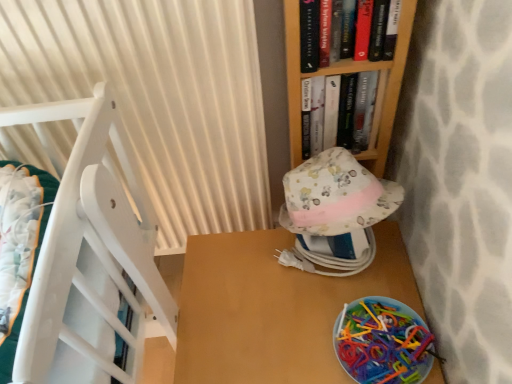
Question: Considering the relative sizes of white pleated curtain at left and floral fabric hat at center in the image provided, is white pleated curtain at left taller than floral fabric hat at center?

Choices:
 (A) yes
 (B) no

Answer: (A)

Question: Could floral fabric hat at center be considered to be inside white pleated curtain at left?

Choices:
 (A) yes
 (B) no

Answer: (B)

Question: Can we say white pleated curtain at left lies outside floral fabric hat at center?

Choices:
 (A) yes
 (B) no

Answer: (A)

Question: Considering the relative sizes of white pleated curtain at left and floral fabric hat at center in the image provided, is white pleated curtain at left smaller than floral fabric hat at center?

Choices:
 (A) yes
 (B) no

Answer: (B)

Question: From a real-world perspective, is white pleated curtain at left located higher than floral fabric hat at center?

Choices:
 (A) yes
 (B) no

Answer: (A)

Question: Considering the relative sizes of white pleated curtain at left and floral fabric hat at center in the image provided, is white pleated curtain at left thinner than floral fabric hat at center?

Choices:
 (A) no
 (B) yes

Answer: (B)

Question: Is there a large distance between wooden table at lower right and floral fabric hat at center?

Choices:
 (A) no
 (B) yes

Answer: (A)

Question: Is wooden table at lower right taller than floral fabric hat at center?

Choices:
 (A) yes
 (B) no

Answer: (A)

Question: Does wooden table at lower right turn towards floral fabric hat at center?

Choices:
 (A) yes
 (B) no

Answer: (B)

Question: Considering the relative sizes of wooden table at lower right and floral fabric hat at center in the image provided, is wooden table at lower right smaller than floral fabric hat at center?

Choices:
 (A) yes
 (B) no

Answer: (B)

Question: Is wooden table at lower right outside of floral fabric hat at center?

Choices:
 (A) no
 (B) yes

Answer: (B)

Question: From the image's perspective, is wooden table at lower right located above floral fabric hat at center?

Choices:
 (A) no
 (B) yes

Answer: (A)

Question: Is white pleated curtain at left oriented towards hardcover book at upper center, which ranks as the 1th book in front-to-back order?

Choices:
 (A) yes
 (B) no

Answer: (B)